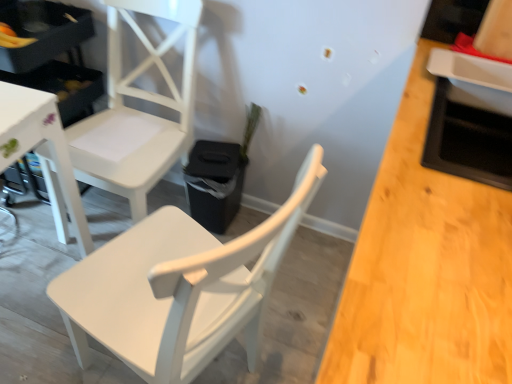
This screenshot has height=384, width=512. What are the coordinates of `white matte chair at center, the 1th chair viewed from the front` in the screenshot? It's located at (179, 288).

Describe the element at coordinates (179, 288) in the screenshot. The height and width of the screenshot is (384, 512). I see `white matte chair at center, the second chair when ordered from back to front` at that location.

Image resolution: width=512 pixels, height=384 pixels. What do you see at coordinates (138, 111) in the screenshot?
I see `white matte chair at upper left, which ranks as the 1th chair in back-to-front order` at bounding box center [138, 111].

Locate an element on the screen. white matte chair at upper left, the second chair in the front-to-back sequence is located at coordinates (138, 111).

Where is `white matte chair at center, the 1th chair viewed from the front`? white matte chair at center, the 1th chair viewed from the front is located at coordinates (179, 288).

Is white matte chair at upper left, the second chair in the front-to-back sequence, at the left side of white matte chair at center, the 1th chair viewed from the front?

Indeed, white matte chair at upper left, the second chair in the front-to-back sequence, is positioned on the left side of white matte chair at center, the 1th chair viewed from the front.

Does white matte chair at upper left, which ranks as the 1th chair in back-to-front order, come in front of white matte chair at center, the second chair when ordered from back to front?

No, it is behind white matte chair at center, the second chair when ordered from back to front.

Between point (137, 209) and point (167, 257), which one is positioned behind?

Point (137, 209)

From the image's perspective, which is above, white matte chair at upper left, the second chair in the front-to-back sequence, or white matte chair at center, the 1th chair viewed from the front?

white matte chair at upper left, the second chair in the front-to-back sequence, is shown above in the image.

Looking at this image, from a real-world perspective, is white matte chair at upper left, which ranks as the 1th chair in back-to-front order, over white matte chair at center, the second chair when ordered from back to front?

No, from a real-world perspective, white matte chair at upper left, which ranks as the 1th chair in back-to-front order, is not above white matte chair at center, the second chair when ordered from back to front.

In terms of width, does white matte chair at upper left, the second chair in the front-to-back sequence, look wider or thinner when compared to white matte chair at center, the second chair when ordered from back to front?

Clearly, white matte chair at upper left, the second chair in the front-to-back sequence, has less width compared to white matte chair at center, the second chair when ordered from back to front.

Is white matte chair at upper left, which ranks as the 1th chair in back-to-front order, shorter than white matte chair at center, the 1th chair viewed from the front?

No.

In terms of size, does white matte chair at upper left, which ranks as the 1th chair in back-to-front order, appear bigger or smaller than white matte chair at center, the second chair when ordered from back to front?

In the image, white matte chair at upper left, which ranks as the 1th chair in back-to-front order, appears to be smaller than white matte chair at center, the second chair when ordered from back to front.

Is white matte chair at upper left, which ranks as the 1th chair in back-to-front order, surrounding white matte chair at center, the 1th chair viewed from the front?

Definitely not — white matte chair at center, the 1th chair viewed from the front, is not inside white matte chair at upper left, which ranks as the 1th chair in back-to-front order.

Are white matte chair at upper left, which ranks as the 1th chair in back-to-front order, and white matte chair at center, the 1th chair viewed from the front, far apart?

No, white matte chair at upper left, which ranks as the 1th chair in back-to-front order, is not far from white matte chair at center, the 1th chair viewed from the front.

Could you tell me if white matte chair at upper left, the second chair in the front-to-back sequence, is turned towards white matte chair at center, the 1th chair viewed from the front?

No, white matte chair at upper left, the second chair in the front-to-back sequence, does not turn towards white matte chair at center, the 1th chair viewed from the front.

Can you tell me how much white matte chair at upper left, the second chair in the front-to-back sequence, and white matte chair at center, the 1th chair viewed from the front, differ in facing direction?

They differ by 106 degrees in their facing directions.

Measure the distance from white matte chair at upper left, the second chair in the front-to-back sequence, to white matte chair at center, the second chair when ordered from back to front.

white matte chair at upper left, the second chair in the front-to-back sequence, and white matte chair at center, the second chair when ordered from back to front, are 21.56 inches apart.

In order to click on chair below the white matte chair at upper left, the second chair in the front-to-back sequence (from the image's perspective) in this screenshot , I will do `click(179, 288)`.

Can you confirm if white matte chair at center, the 1th chair viewed from the front, is positioned to the left of white matte chair at upper left, the second chair in the front-to-back sequence?

No, white matte chair at center, the 1th chair viewed from the front, is not to the left of white matte chair at upper left, the second chair in the front-to-back sequence.

Between white matte chair at center, the second chair when ordered from back to front, and white matte chair at upper left, which ranks as the 1th chair in back-to-front order, which one is positioned in front?

Positioned in front is white matte chair at center, the second chair when ordered from back to front.

Which is closer, (303,165) or (175,146)?

Clearly, point (303,165) is closer to the camera than point (175,146).

Based on the photo, from the image's perspective, which is above, white matte chair at center, the second chair when ordered from back to front, or white matte chair at upper left, which ranks as the 1th chair in back-to-front order?

white matte chair at upper left, which ranks as the 1th chair in back-to-front order, appears higher in the image.

From a real-world perspective, is white matte chair at center, the second chair when ordered from back to front, positioned above or below white matte chair at upper left, which ranks as the 1th chair in back-to-front order?

From a real-world perspective, white matte chair at center, the second chair when ordered from back to front, is physically above white matte chair at upper left, which ranks as the 1th chair in back-to-front order.

Can you confirm if white matte chair at center, the second chair when ordered from back to front, is thinner than white matte chair at upper left, the second chair in the front-to-back sequence?

No.

Can you confirm if white matte chair at center, the 1th chair viewed from the front, is taller than white matte chair at upper left, the second chair in the front-to-back sequence?

In fact, white matte chair at center, the 1th chair viewed from the front, may be shorter than white matte chair at upper left, the second chair in the front-to-back sequence.

Is white matte chair at center, the second chair when ordered from back to front, bigger than white matte chair at upper left, which ranks as the 1th chair in back-to-front order?

Correct, white matte chair at center, the second chair when ordered from back to front, is larger in size than white matte chair at upper left, which ranks as the 1th chair in back-to-front order.

Is white matte chair at center, the 1th chair viewed from the front, inside the boundaries of white matte chair at upper left, which ranks as the 1th chair in back-to-front order, or outside?

white matte chair at center, the 1th chair viewed from the front, is located beyond the bounds of white matte chair at upper left, which ranks as the 1th chair in back-to-front order.

Is white matte chair at center, the second chair when ordered from back to front, in contact with white matte chair at upper left, which ranks as the 1th chair in back-to-front order?

No, white matte chair at center, the second chair when ordered from back to front, is not making contact with white matte chair at upper left, which ranks as the 1th chair in back-to-front order.

Is white matte chair at center, the second chair when ordered from back to front, facing towards white matte chair at upper left, which ranks as the 1th chair in back-to-front order?

No.

Could you measure the distance between white matte chair at center, the 1th chair viewed from the front, and white matte chair at upper left, which ranks as the 1th chair in back-to-front order?

white matte chair at center, the 1th chair viewed from the front, and white matte chair at upper left, which ranks as the 1th chair in back-to-front order, are 21.56 inches apart.

Locate an element on the screen. The width and height of the screenshot is (512, 384). chair above the white matte chair at center, the second chair when ordered from back to front (from the image's perspective) is located at coordinates (138, 111).

At what (x,y) coordinates should I click in order to perform the action: click on chair above the white matte chair at upper left, the second chair in the front-to-back sequence (from a real-world perspective). Please return your answer as a coordinate pair (x, y). Looking at the image, I should click on (179, 288).

Identify the location of chair to the left of white matte chair at center, the 1th chair viewed from the front. The height and width of the screenshot is (384, 512). (138, 111).